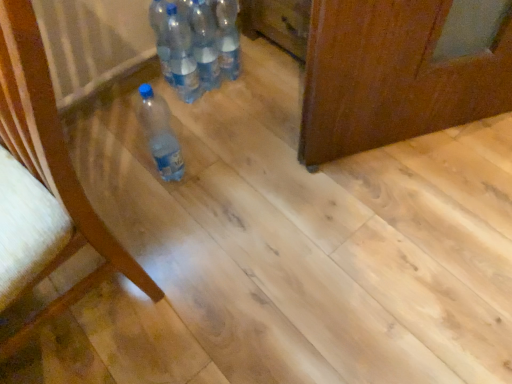
What do you see at coordinates (182, 56) in the screenshot? I see `clear plastic bottle at center, which is counted as the second bottle, starting from the bottom` at bounding box center [182, 56].

What is the approximate height of translucent plastic bottle at lower left, which is counted as the 4th bottle, starting from the top?

It is 33.27 centimeters.

In order to face translucent plastic bottle at lower left, marked as the 1th bottle in a bottom-to-top arrangement, should I rotate leftwards or rightwards?

To align with it, rotate left about 12.801°.

Identify the location of clear plastic bottle at center, the 3th bottle viewed from the top. (182, 56).

Considering the sizes of objects translucent plastic bottle at center, marked as the 1th bottle in a top-to-bottom arrangement, and translucent plastic bottle at lower left, marked as the 1th bottle in a bottom-to-top arrangement, in the image provided, who is shorter, translucent plastic bottle at center, marked as the 1th bottle in a top-to-bottom arrangement, or translucent plastic bottle at lower left, marked as the 1th bottle in a bottom-to-top arrangement,?

translucent plastic bottle at lower left, marked as the 1th bottle in a bottom-to-top arrangement, is shorter.

From a real-world perspective, is translucent plastic bottle at center, the fourth bottle when ordered from bottom to top, physically below translucent plastic bottle at lower left, which is counted as the 4th bottle, starting from the top?

No, from a real-world perspective, translucent plastic bottle at center, the fourth bottle when ordered from bottom to top, is not below translucent plastic bottle at lower left, which is counted as the 4th bottle, starting from the top.

From a real-world perspective, between clear plastic bottle at center, the 3th bottle viewed from the top, and translucent plastic bottles at center, which is the 2th bottle in top-to-bottom order, who is vertically higher?

In real-world perspective, translucent plastic bottles at center, which is the 2th bottle in top-to-bottom order, is above.

From the image's perspective, which one is positioned higher, clear plastic bottle at center, the 3th bottle viewed from the top, or translucent plastic bottles at center, which is the 2th bottle in top-to-bottom order?

translucent plastic bottles at center, which is the 2th bottle in top-to-bottom order.

From the image's perspective, starting from the clear plastic bottle at center, the 3th bottle viewed from the top, which bottle is the 1st one above? Please provide its 2D coordinates.

[(205, 44)]

Does translucent plastic bottle at center, the fourth bottle when ordered from bottom to top, have a larger size compared to matte wood chair at left?

Incorrect, translucent plastic bottle at center, the fourth bottle when ordered from bottom to top, is not larger than matte wood chair at left.

From a real-world perspective, relative to matte wood chair at left, is translucent plastic bottle at center, marked as the 1th bottle in a top-to-bottom arrangement, vertically above or below?

In terms of real-world spatial position, translucent plastic bottle at center, marked as the 1th bottle in a top-to-bottom arrangement, is below matte wood chair at left.

The image size is (512, 384). Find the location of `furniture that appears below the translucent plastic bottle at center, the fourth bottle when ordered from bottom to top (from the image's perspective)`. furniture that appears below the translucent plastic bottle at center, the fourth bottle when ordered from bottom to top (from the image's perspective) is located at coordinates (47, 179).

In terms of height, does translucent plastic bottle at center, the fourth bottle when ordered from bottom to top, look taller or shorter compared to matte wood chair at left?

translucent plastic bottle at center, the fourth bottle when ordered from bottom to top, is shorter than matte wood chair at left.

Does matte wood chair at left have a lesser width compared to translucent plastic bottle at lower left, marked as the 1th bottle in a bottom-to-top arrangement?

No.

Is matte wood chair at left taller or shorter than translucent plastic bottle at lower left, marked as the 1th bottle in a bottom-to-top arrangement?

A: Considering their sizes, matte wood chair at left has more height than translucent plastic bottle at lower left, marked as the 1th bottle in a bottom-to-top arrangement.

Which object is positioned more to the left, matte wood chair at left or translucent plastic bottle at lower left, marked as the 1th bottle in a bottom-to-top arrangement?

Positioned to the left is matte wood chair at left.

The image size is (512, 384). I want to click on furniture lying below the translucent plastic bottle at lower left, marked as the 1th bottle in a bottom-to-top arrangement (from the image's perspective), so click(x=47, y=179).

Between translucent plastic bottles at center, the third bottle positioned from the bottom, and translucent plastic bottle at center, the fourth bottle when ordered from bottom to top, which one has less height?

translucent plastic bottle at center, the fourth bottle when ordered from bottom to top, is shorter.

Is translucent plastic bottles at center, which is the 2th bottle in top-to-bottom order, bigger than translucent plastic bottle at center, marked as the 1th bottle in a top-to-bottom arrangement?

Incorrect, translucent plastic bottles at center, which is the 2th bottle in top-to-bottom order, is not larger than translucent plastic bottle at center, marked as the 1th bottle in a top-to-bottom arrangement.

Considering the sizes of objects translucent plastic bottles at center, which is the 2th bottle in top-to-bottom order, and translucent plastic bottle at center, marked as the 1th bottle in a top-to-bottom arrangement, in the image provided, who is thinner, translucent plastic bottles at center, which is the 2th bottle in top-to-bottom order, or translucent plastic bottle at center, marked as the 1th bottle in a top-to-bottom arrangement,?

translucent plastic bottles at center, which is the 2th bottle in top-to-bottom order, is thinner.

Are translucent plastic bottle at lower left, which is counted as the 4th bottle, starting from the top, and clear plastic bottle at center, the 3th bottle viewed from the top, located far from each other?

translucent plastic bottle at lower left, which is counted as the 4th bottle, starting from the top, is actually quite close to clear plastic bottle at center, the 3th bottle viewed from the top.

Considering their positions, is translucent plastic bottle at lower left, marked as the 1th bottle in a bottom-to-top arrangement, located in front of or behind clear plastic bottle at center, the 3th bottle viewed from the top?

Visually, translucent plastic bottle at lower left, marked as the 1th bottle in a bottom-to-top arrangement, is located in front of clear plastic bottle at center, the 3th bottle viewed from the top.

From the image's perspective, who appears lower, translucent plastic bottle at lower left, marked as the 1th bottle in a bottom-to-top arrangement, or clear plastic bottle at center, which is counted as the second bottle, starting from the bottom?

translucent plastic bottle at lower left, marked as the 1th bottle in a bottom-to-top arrangement.

Based on their positions, is translucent plastic bottle at lower left, marked as the 1th bottle in a bottom-to-top arrangement, located to the left or right of clear plastic bottle at center, the 3th bottle viewed from the top?

Based on their positions, translucent plastic bottle at lower left, marked as the 1th bottle in a bottom-to-top arrangement, is located to the left of clear plastic bottle at center, the 3th bottle viewed from the top.

Is clear plastic bottle at center, which is counted as the second bottle, starting from the bottom, not inside matte wood chair at left?

Yes.

Between clear plastic bottle at center, the 3th bottle viewed from the top, and matte wood chair at left, which one has larger size?

With larger size is matte wood chair at left.

Does clear plastic bottle at center, the 3th bottle viewed from the top, have a greater width compared to matte wood chair at left?

In fact, clear plastic bottle at center, the 3th bottle viewed from the top, might be narrower than matte wood chair at left.

Is the surface of clear plastic bottle at center, the 3th bottle viewed from the top, in direct contact with matte wood chair at left?

clear plastic bottle at center, the 3th bottle viewed from the top, and matte wood chair at left are not in contact.

Locate an element on the screen. The width and height of the screenshot is (512, 384). bottle that is the 3rd one when counting backward from the translucent plastic bottle at lower left, which is counted as the 4th bottle, starting from the top is located at coordinates 228,37.

Identify the location of the 1st bottle above the clear plastic bottle at center, the 3th bottle viewed from the top (from the image's perspective). The image size is (512, 384). (205, 44).

Based on the photo, from the image, which object appears to be farther from clear plastic bottle at center, which is counted as the second bottle, starting from the bottom, translucent plastic bottle at center, marked as the 1th bottle in a top-to-bottom arrangement, or translucent plastic bottles at center, which is the 2th bottle in top-to-bottom order?

The object further to clear plastic bottle at center, which is counted as the second bottle, starting from the bottom, is translucent plastic bottle at center, marked as the 1th bottle in a top-to-bottom arrangement.

Estimate the real-world distances between objects in this image. Which object is closer to translucent plastic bottle at center, marked as the 1th bottle in a top-to-bottom arrangement, clear plastic bottle at center, which is counted as the second bottle, starting from the bottom, or translucent plastic bottle at lower left, marked as the 1th bottle in a bottom-to-top arrangement?

clear plastic bottle at center, which is counted as the second bottle, starting from the bottom.

Which object lies nearer to the anchor point matte wood chair at left, translucent plastic bottles at center, the third bottle positioned from the bottom, or translucent plastic bottle at lower left, marked as the 1th bottle in a bottom-to-top arrangement?

translucent plastic bottle at lower left, marked as the 1th bottle in a bottom-to-top arrangement, is closer to matte wood chair at left.

Considering their positions, is translucent plastic bottle at lower left, marked as the 1th bottle in a bottom-to-top arrangement, positioned further to clear plastic bottle at center, which is counted as the second bottle, starting from the bottom, than translucent plastic bottle at center, marked as the 1th bottle in a top-to-bottom arrangement?

translucent plastic bottle at lower left, marked as the 1th bottle in a bottom-to-top arrangement, lies further to clear plastic bottle at center, which is counted as the second bottle, starting from the bottom, than the other object.

When comparing their distances from translucent plastic bottle at lower left, which is counted as the 4th bottle, starting from the top, does translucent plastic bottle at center, the fourth bottle when ordered from bottom to top, or matte wood chair at left seem further?

matte wood chair at left is further to translucent plastic bottle at lower left, which is counted as the 4th bottle, starting from the top.

From the image, which object appears to be farther from clear plastic bottle at center, the 3th bottle viewed from the top, translucent plastic bottle at center, the fourth bottle when ordered from bottom to top, or matte wood chair at left?

Among the two, matte wood chair at left is located further to clear plastic bottle at center, the 3th bottle viewed from the top.

Looking at this image, looking at the image, which one is located closer to translucent plastic bottle at center, marked as the 1th bottle in a top-to-bottom arrangement, translucent plastic bottle at lower left, marked as the 1th bottle in a bottom-to-top arrangement, or matte wood chair at left?

translucent plastic bottle at lower left, marked as the 1th bottle in a bottom-to-top arrangement, is positioned closer to the anchor translucent plastic bottle at center, marked as the 1th bottle in a top-to-bottom arrangement.

Based on their spatial positions, is matte wood chair at left or clear plastic bottle at center, the 3th bottle viewed from the top, closer to translucent plastic bottle at center, the fourth bottle when ordered from bottom to top?

clear plastic bottle at center, the 3th bottle viewed from the top, is positioned closer to the anchor translucent plastic bottle at center, the fourth bottle when ordered from bottom to top.

Locate an element on the screen. bottle between clear plastic bottle at center, the 3th bottle viewed from the top, and translucent plastic bottle at center, marked as the 1th bottle in a top-to-bottom arrangement, in the horizontal direction is located at coordinates (205, 44).

In order to click on bottle between translucent plastic bottles at center, the third bottle positioned from the bottom, and translucent plastic bottle at lower left, which is counted as the 4th bottle, starting from the top, from top to bottom in this screenshot , I will do `click(182, 56)`.

Where is `bottle between matte wood chair at left and clear plastic bottle at center, which is counted as the second bottle, starting from the bottom, along the z-axis`? The image size is (512, 384). bottle between matte wood chair at left and clear plastic bottle at center, which is counted as the second bottle, starting from the bottom, along the z-axis is located at coordinates (160, 134).